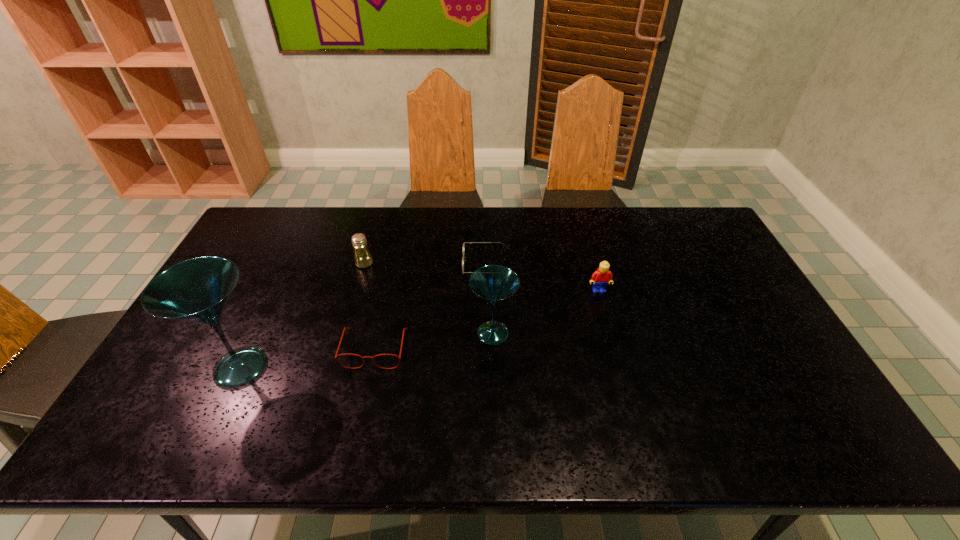
At what (x,y) coordinates should I click in order to perform the action: click on vacant space in between the fourth nearest object and the shortest object. Please return your answer as a coordinate pair (x, y). Looking at the image, I should click on (542, 278).

Where is `vacant area between the left martini and the right martini`? vacant area between the left martini and the right martini is located at coordinates (367, 350).

This screenshot has height=540, width=960. In order to click on free space between the taller martini and the saltshaker in this screenshot , I will do `click(302, 315)`.

Locate an element on the screen. vacant space that is in between the tallest object and the sunglasses is located at coordinates (364, 316).

I want to click on object identified as the closest to the fifth tallest object, so click(x=197, y=290).

Find the location of a particular element. Image resolution: width=960 pixels, height=540 pixels. object that stands as the second closest to the second shortest object is located at coordinates (493, 283).

Find the location of a particular element. free space that satisfies the following two spatial constraints: 1. on the front-facing side of the shortest object; 2. on the face of the spectacles is located at coordinates (489, 348).

Find the location of a particular element. This screenshot has width=960, height=540. vacant space that satisfies the following two spatial constraints: 1. on the front-facing side of the right martini; 2. on the left side of the sunglasses is located at coordinates (489, 333).